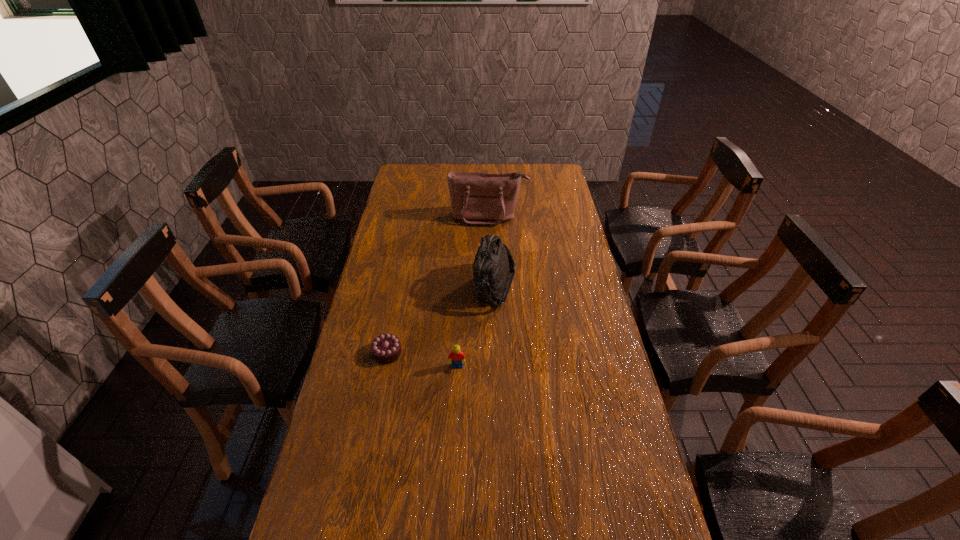
Identify the location of the farthest object. This screenshot has width=960, height=540. 477,198.

Find the location of a particular element. This screenshot has height=540, width=960. the second farthest object is located at coordinates (493, 271).

This screenshot has width=960, height=540. In order to click on Lego in this screenshot , I will do `click(456, 356)`.

Image resolution: width=960 pixels, height=540 pixels. What are the coordinates of `chocolate cake` in the screenshot? It's located at (386, 348).

The height and width of the screenshot is (540, 960). In order to click on the shortest object in this screenshot , I will do `click(386, 348)`.

The image size is (960, 540). I want to click on vacant space located 0.180m on the front pocket of the farthest object, so click(x=490, y=253).

Where is `vacant space located 0.270m at the front padded panel of the nearer shoulder bag`? vacant space located 0.270m at the front padded panel of the nearer shoulder bag is located at coordinates (402, 287).

At what (x,y) coordinates should I click in order to perform the action: click on vacant space located at the front padded panel of the nearer shoulder bag. Please return your answer as a coordinate pair (x, y). The height and width of the screenshot is (540, 960). Looking at the image, I should click on (371, 287).

I want to click on vacant space located at the front padded panel of the nearer shoulder bag, so click(x=392, y=287).

I want to click on vacant space located 0.280m on the face of the second shortest object, so click(453, 458).